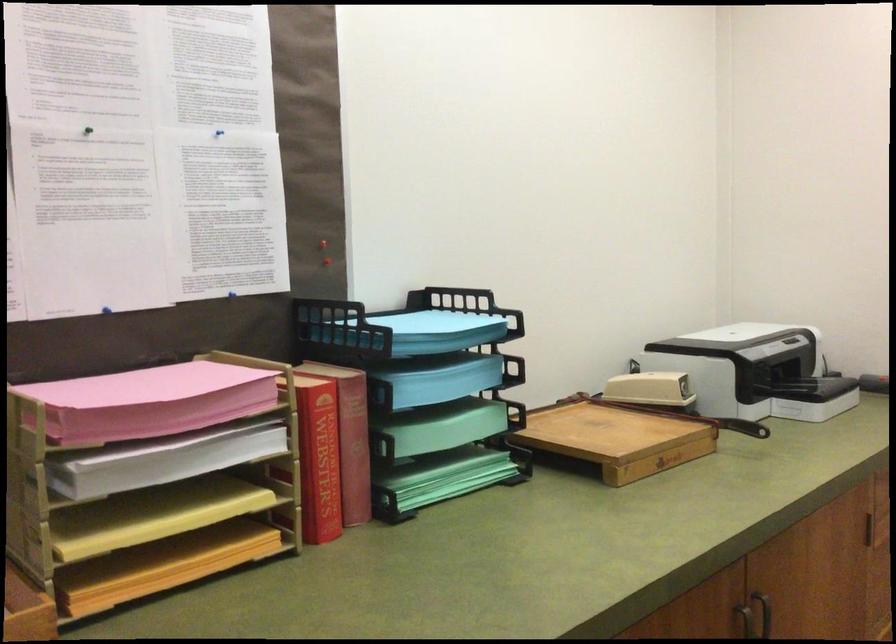
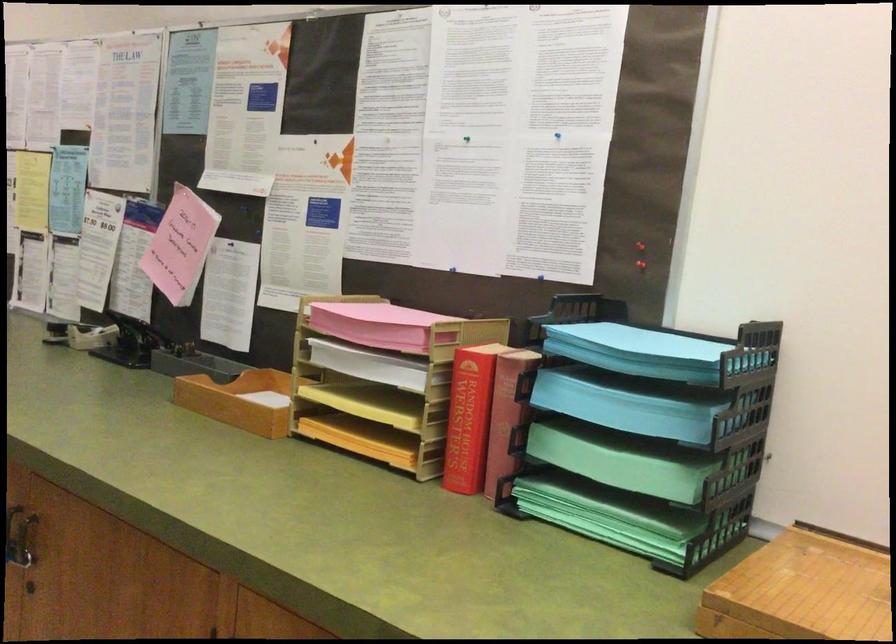
Find the pixel in the second image that matches (328,460) in the first image.

(469, 418)